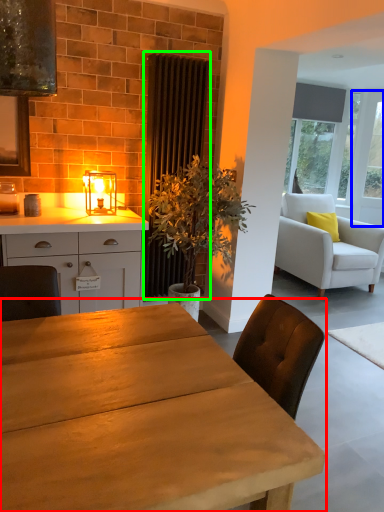
Question: Which is nearer to the table (highlighted by a red box)? glass door (highlighted by a blue box) or curtain (highlighted by a green box).

Choices:
 (A) glass door
 (B) curtain

Answer: (B)